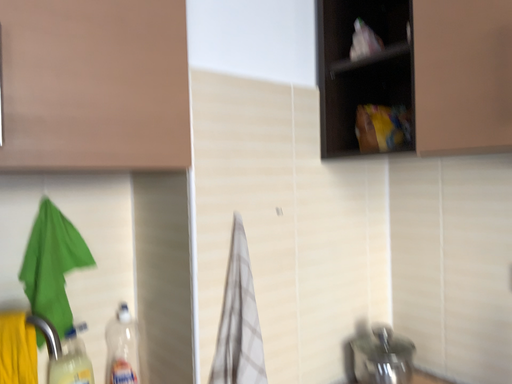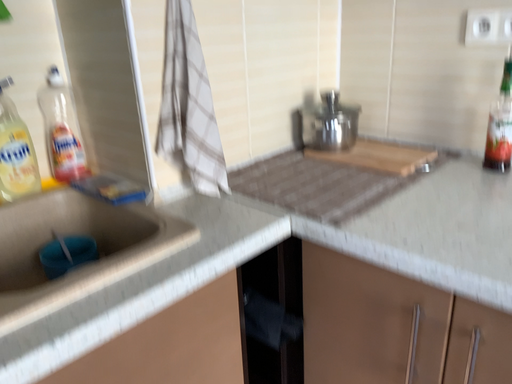
Question: Which way did the camera rotate in the video?

Choices:
 (A) rotated upward
 (B) rotated downward

Answer: (B)